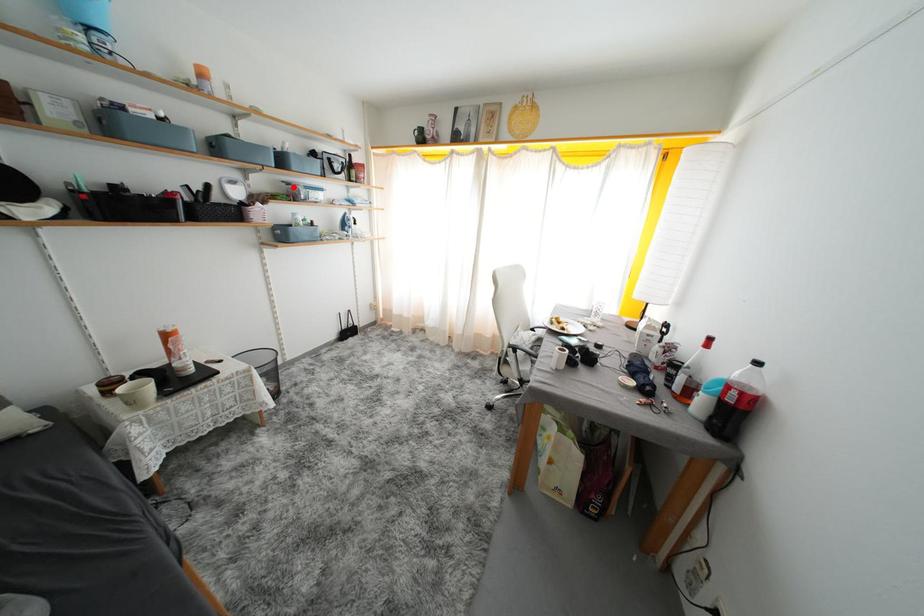
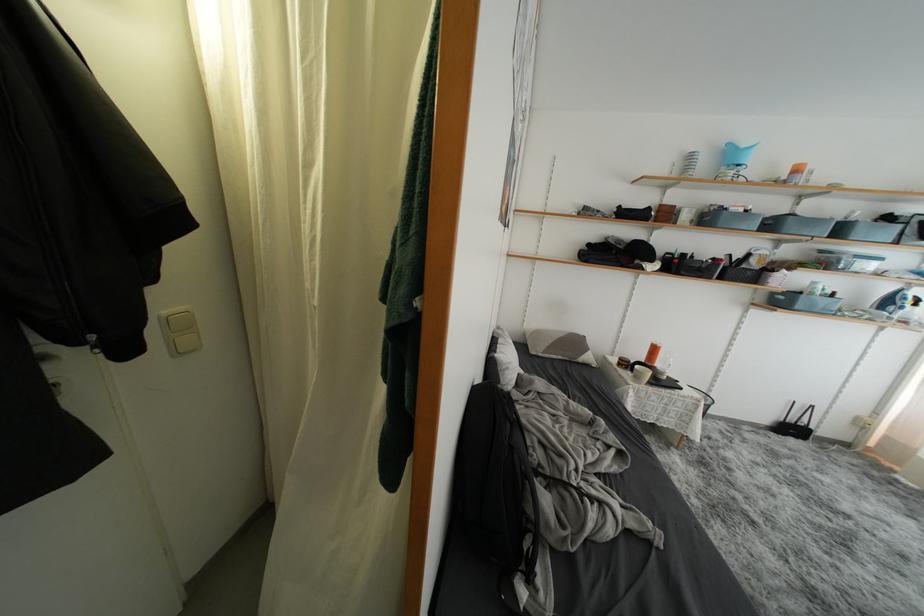
Question: I am providing you with two images of the same scene from different viewpoints. Image1 has a red point marked. In image2, the corresponding 3D location appears at what relative position? Reply with the corresponding letter.

Choices:
 (A) Closer
 (B) Farther

Answer: (B)